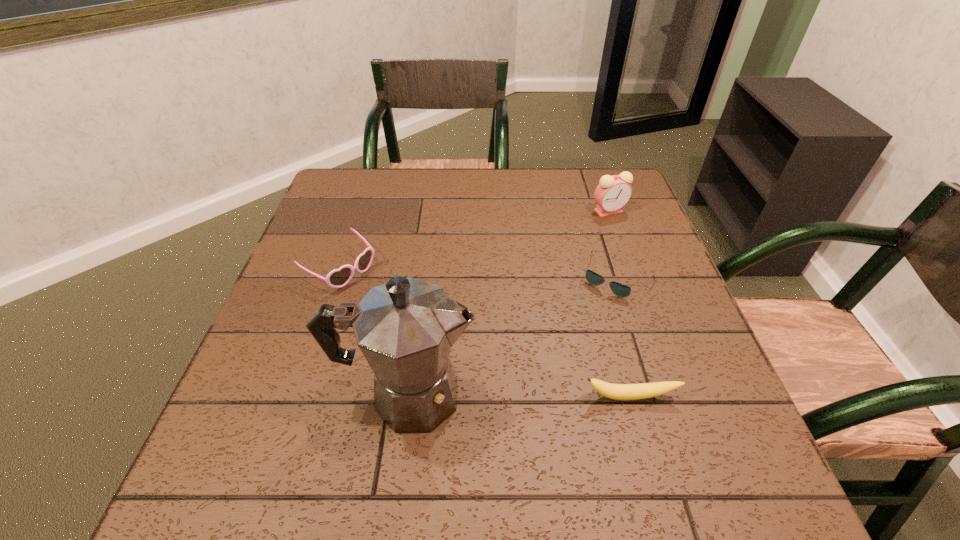
Where is `vacant space on the desktop that is between the tallest object and the banana and is positioned on the face of the farthest object`? Image resolution: width=960 pixels, height=540 pixels. vacant space on the desktop that is between the tallest object and the banana and is positioned on the face of the farthest object is located at coordinates (550, 396).

This screenshot has width=960, height=540. Find the location of `free space on the desktop that is between the tallest object and the banana and is positioned on the lenses of the shorter sunglasses`. free space on the desktop that is between the tallest object and the banana and is positioned on the lenses of the shorter sunglasses is located at coordinates (533, 396).

At what (x,y) coordinates should I click in order to perform the action: click on free spot on the desktop that is between the coffeepot and the banana and is positioned on the front-facing side of the taller sunglasses. Please return your answer as a coordinate pair (x, y). This screenshot has width=960, height=540. Looking at the image, I should click on (530, 396).